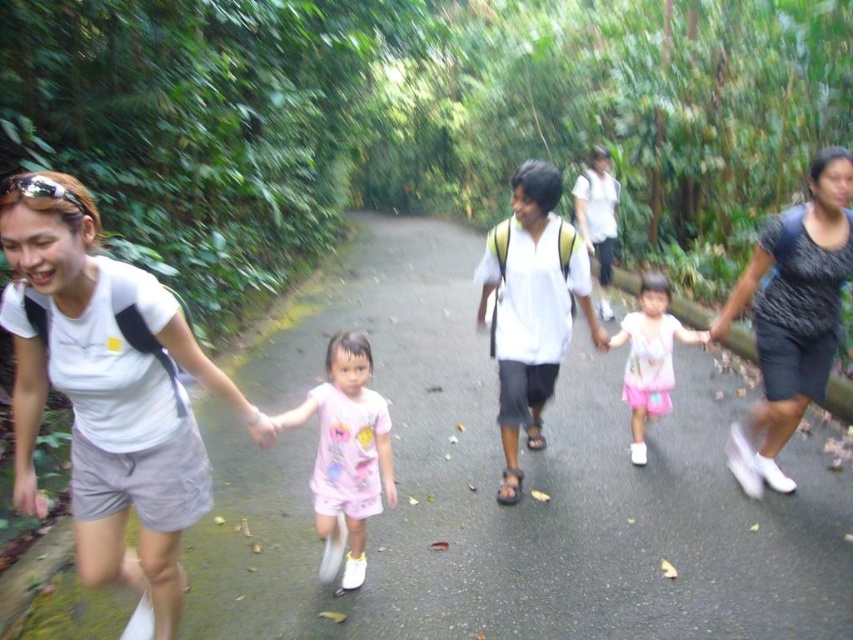
You are a delivery person carrying a package that requires a clear path of at least 6 feet between the asphalt road at center and the dark gray dress at right to avoid obstacles. Can you safely navigate through this area?

The asphalt road at center and dark gray dress at right are 6.18 feet apart from each other, which is more than the required 6 feet. Therefore, you can safely navigate through this area.

You are a photographer trying to capture the group of people in the scene. You notice the pink cotton dress at center and the pink fabric dress at center. Which dress should you focus on if you want to take a photo that includes both dresses and the damp path in the background?

You should focus on the pink cotton dress at center because it is located below the pink fabric dress at center, ensuring both dresses are in the frame while the damp path remains visible in the background.

You are a photographer aiming to capture a clear shot of the pink cotton dress at center and the pink fabric dress at center. Since both dresses are pink, which one is closer to you so you can focus your camera accordingly?

The pink cotton dress at center is closer to you because it is in front of the pink fabric dress at center.